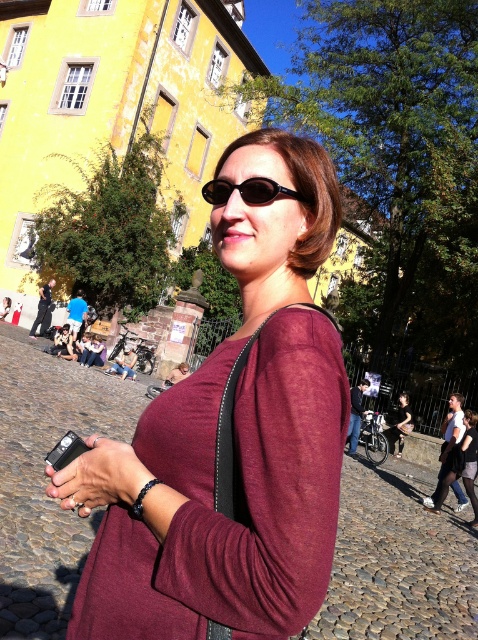
You are a photographer trying to capture the entire scene of the European town square. You have a matte black phone at center and black leather pants at lower right in your frame. Which object should you adjust your focus to ensure both are in the frame without cropping?

The matte black phone at center has a lesser height compared to black leather pants at lower right, so you should focus on the taller object, the black leather pants at lower right, to ensure both are in the frame without cropping.

You are a photographer trying to capture the woman in the scene. To ensure both the burgundy fabric shirt at center and the black leather pants at lower right are visible in your shot, where should you position your camera relative to her?

The burgundy fabric shirt at center is positioned over the black leather pants at lower right, so positioning the camera at an angle where both the upper and lower parts of her body are visible will ensure both items are captured in the photo.

You are a photographer trying to capture the scene of the woman in the European town square. You notice the matte black jacket at center and the matte black camera at center. Which object is closer to the bottom of the image?

The matte black jacket at center is positioned under the matte black camera at center, so it is closer to the bottom of the image.